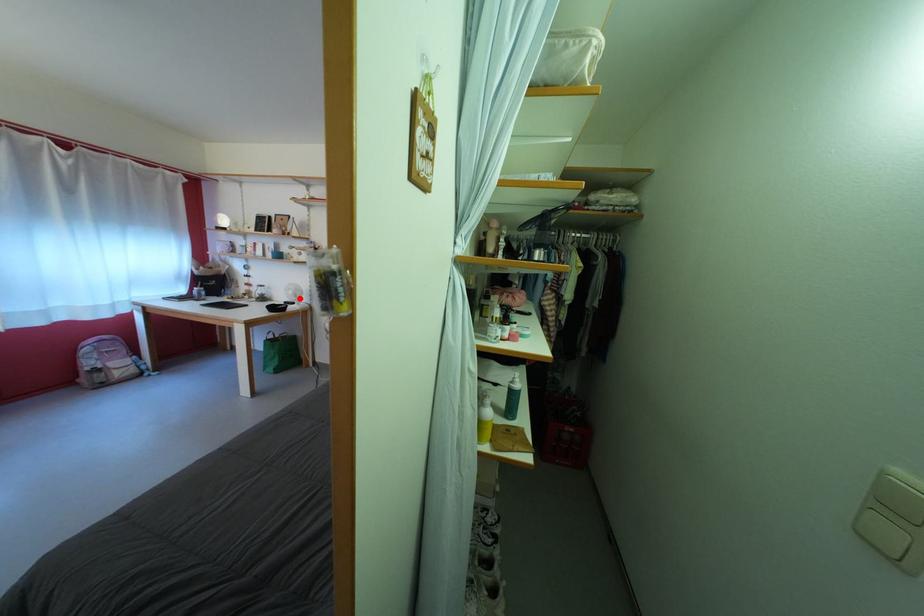
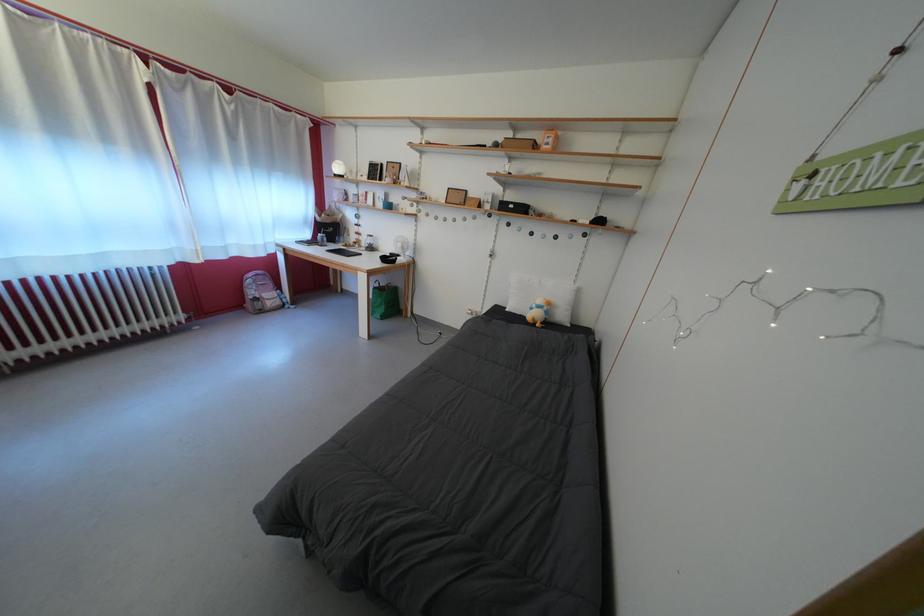
The point at the highlighted location is marked in the first image. Where is the corresponding point in the second image?

(407, 251)